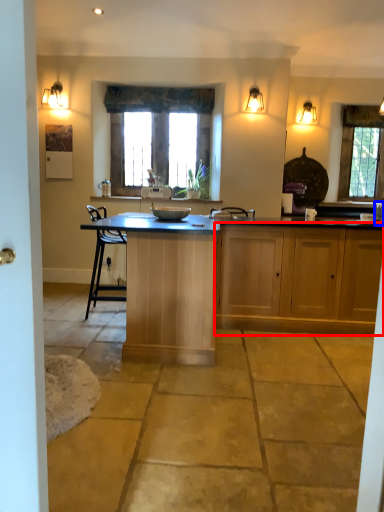
Question: Which of the following is the closest to the observer, cabinetry (highlighted by a red box) or faucet (highlighted by a blue box)?

Choices:
 (A) cabinetry
 (B) faucet

Answer: (A)